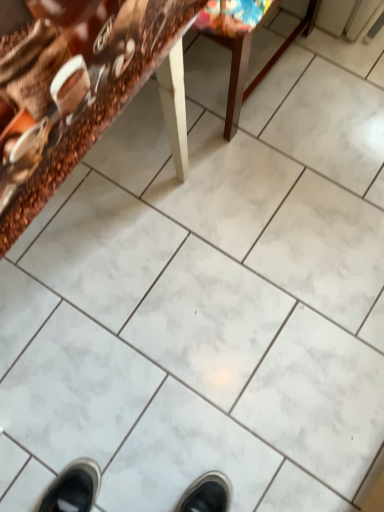
You are a GUI agent. You are given a task and a screenshot of the screen. Output one action in this format:
    pyautogui.click(x=<x>, y=<y>)
    Task: Click on the free space to the right of wooden armchair at upper center
    
    Given the screenshot: What is the action you would take?
    pyautogui.click(x=329, y=81)